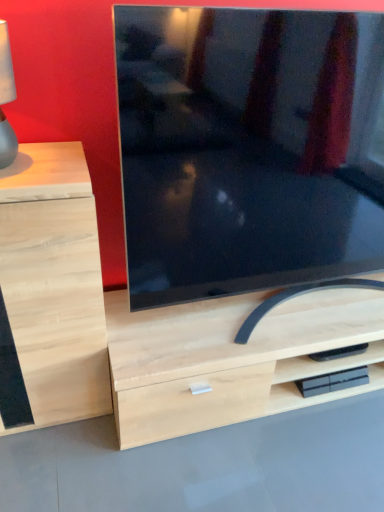
Find the location of a particular element. vacant space behind matte gray lampshade at left is located at coordinates (47, 143).